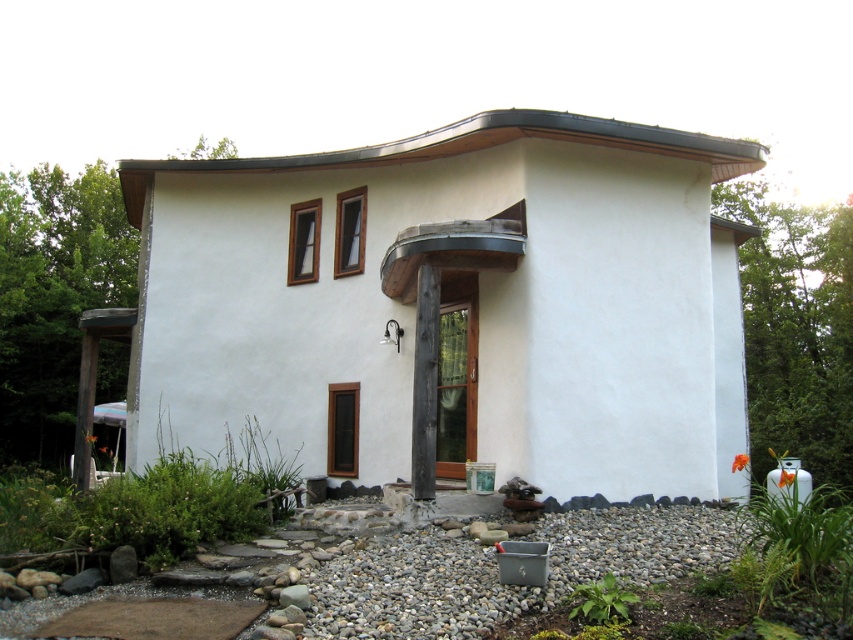
Question: Which point is farther from the camera taking this photo?

Choices:
 (A) (119, 582)
 (B) (281, 592)

Answer: (A)

Question: Does gray stone at lower left have a larger size compared to gray smooth rock at lower center?

Choices:
 (A) yes
 (B) no

Answer: (B)

Question: From the image, what is the correct spatial relationship of gray stone at lower left in relation to gray smooth rock at lower center?

Choices:
 (A) below
 (B) above

Answer: (A)

Question: Which point appears closest to the camera in this image?

Choices:
 (A) (291, 592)
 (B) (123, 557)

Answer: (A)

Question: Which of the following is the closest to the observer?

Choices:
 (A) (131, 564)
 (B) (299, 593)

Answer: (B)

Question: Is gray stone at lower left wider than gray smooth rock at lower center?

Choices:
 (A) no
 (B) yes

Answer: (A)